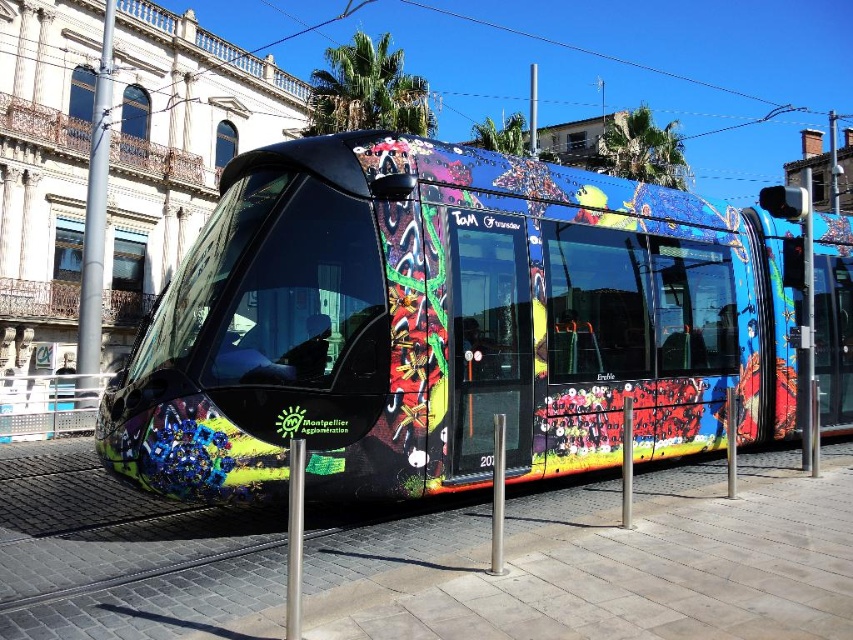
Does point (663, 374) lie behind point (102, 195)?

No, (663, 374) is in front of (102, 195).

Is multicolored graffiti train at center to the left of silver metallic pole at left from the viewer's perspective?

No, multicolored graffiti train at center is not to the left of silver metallic pole at left.

This screenshot has width=853, height=640. In order to click on multicolored graffiti train at center in this screenshot , I will do `click(454, 321)`.